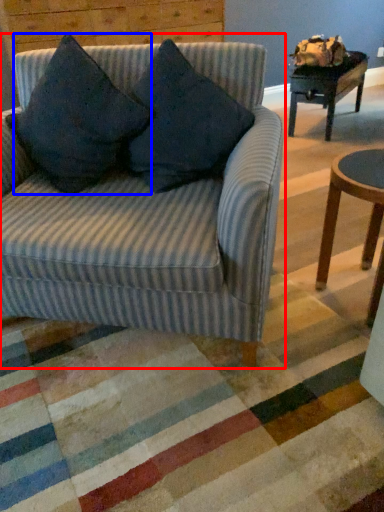
Question: Which of the following is the farthest to the observer, studio couch (highlighted by a red box) or throw pillow (highlighted by a blue box)?

Choices:
 (A) studio couch
 (B) throw pillow

Answer: (B)